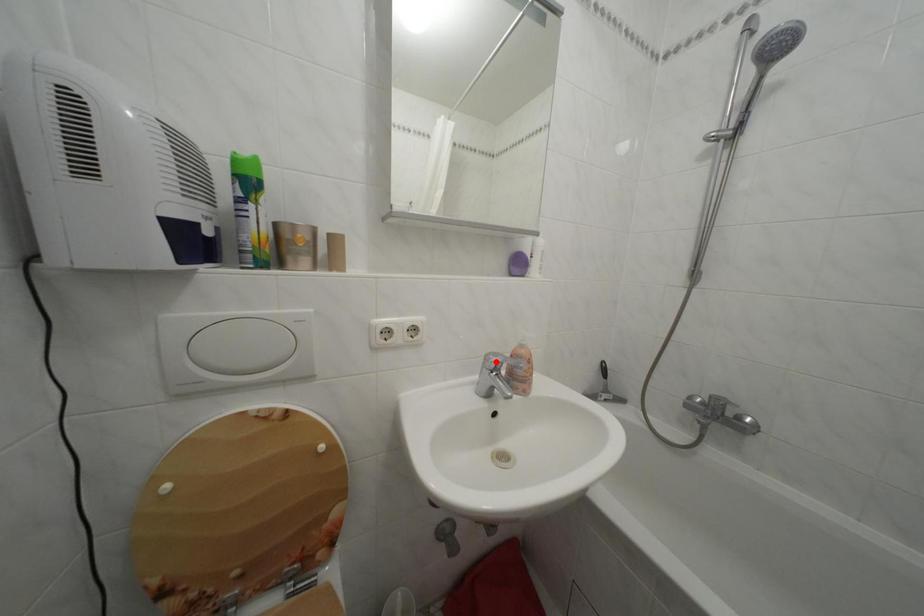
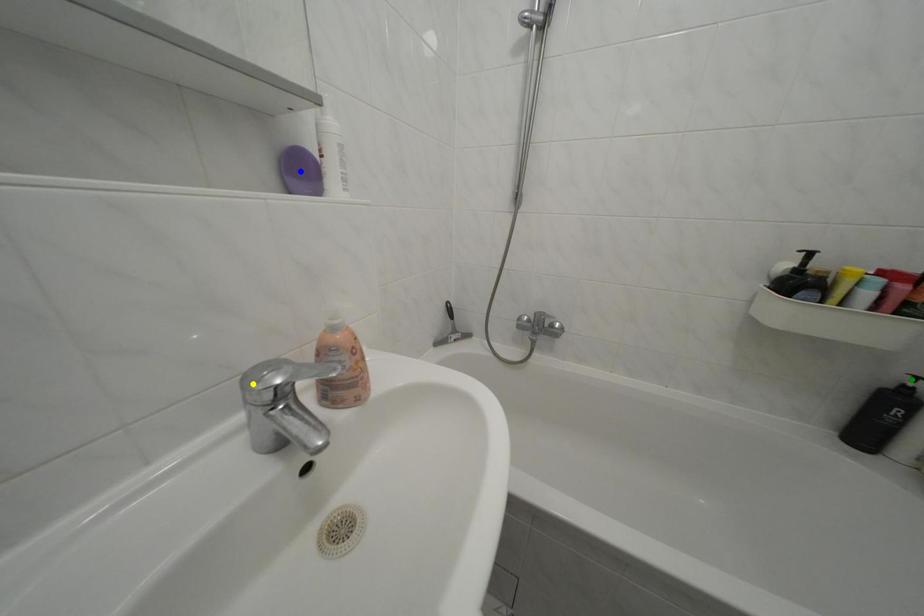
Question: I am providing you with two images of the same scene from different viewpoints. A red point is marked on the first image. You are given multiple points on the second image. Can you choose the point in image 2 that corresponds to the point in image 1?

Choices:
 (A) blue point
 (B) yellow point
 (C) green point

Answer: (B)